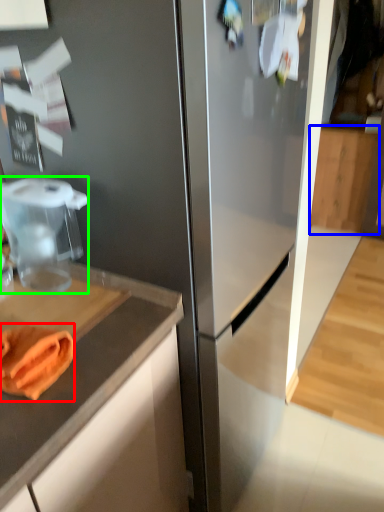
Question: Which object is the farthest from food (highlighted by a red box)? Choose among these: cabinetry (highlighted by a blue box) or food processor (highlighted by a green box).

Choices:
 (A) cabinetry
 (B) food processor

Answer: (A)